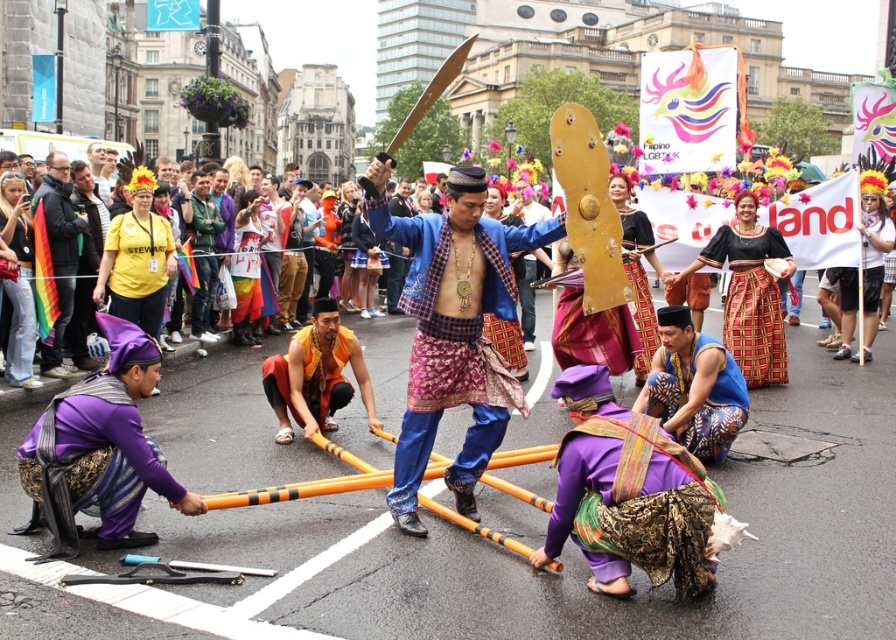
Does shiny blue fabric at center have a larger size compared to rainbow flag at left?

Correct, shiny blue fabric at center is larger in size than rainbow flag at left.

Can you confirm if shiny blue fabric at center is taller than rainbow flag at left?

Indeed, shiny blue fabric at center has a greater height compared to rainbow flag at left.

Does point (464, 502) come in front of point (58, 154)?

Yes, point (464, 502) is in front of point (58, 154).

Locate an element on the screen. Image resolution: width=896 pixels, height=640 pixels. shiny blue fabric at center is located at coordinates (453, 332).